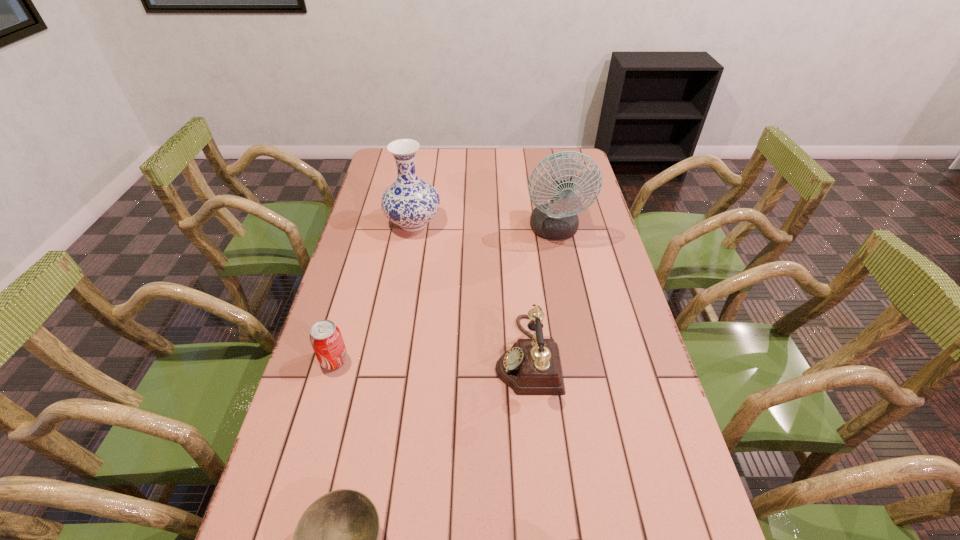
This screenshot has width=960, height=540. What are the coordinates of `vase that is at the left edge` in the screenshot? It's located at (410, 202).

Image resolution: width=960 pixels, height=540 pixels. Identify the location of soda at the left edge. (325, 337).

I want to click on object positioned at the right edge, so click(x=557, y=219).

Where is `vacant space at the far edge`? vacant space at the far edge is located at coordinates (438, 171).

Where is `blank space at the left edge of the desktop`? The width and height of the screenshot is (960, 540). blank space at the left edge of the desktop is located at coordinates (355, 231).

At what (x,y) coordinates should I click in order to perform the action: click on vacant region at the right edge. Please return your answer as a coordinate pair (x, y). The width and height of the screenshot is (960, 540). Looking at the image, I should click on (571, 255).

Locate an element on the screen. This screenshot has width=960, height=540. vacant region between the vase and the fan is located at coordinates (484, 227).

You are a GUI agent. You are given a task and a screenshot of the screen. Output one action in this format:
    pyautogui.click(x=<x>, y=<y>)
    Task: Click on the vacant area between the soda and the fan
    The width and height of the screenshot is (960, 540).
    Given the screenshot: What is the action you would take?
    pyautogui.click(x=444, y=295)

Select which object is the closest to the shortest object. Please provide its 2D coordinates. Your answer should be formatted as a tuple, i.e. [(x, y)], where the tuple contains the x and y coordinates of a point satisfying the conditions above.

[(573, 539)]

Identify which object is located as the second nearest to the fan. Please provide its 2D coordinates. Your answer should be formatted as a tuple, i.e. [(x, y)], where the tuple contains the x and y coordinates of a point satisfying the conditions above.

[(410, 202)]